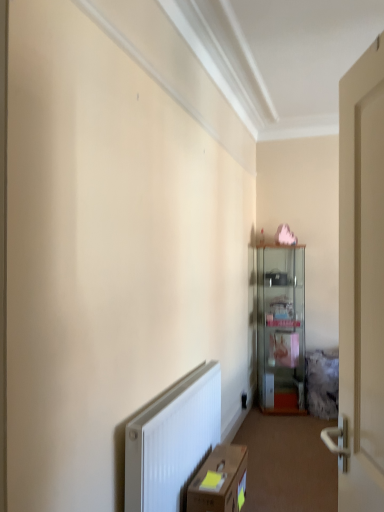
Image resolution: width=384 pixels, height=512 pixels. What do you see at coordinates (219, 481) in the screenshot?
I see `brown cardboard box at lower center` at bounding box center [219, 481].

Locate an element on the screen. This screenshot has height=512, width=384. brown cardboard box at lower center is located at coordinates (219, 481).

Describe the element at coordinates (281, 327) in the screenshot. This screenshot has width=384, height=512. I see `clear glass cabinet at center` at that location.

You are a GUI agent. You are given a task and a screenshot of the screen. Output one action in this format:
    pyautogui.click(x=<x>, y=<y>)
    Task: Click on the clear glass cabinet at center
    Image resolution: width=384 pixels, height=512 pixels.
    Given the screenshot: What is the action you would take?
    pyautogui.click(x=281, y=327)

The image size is (384, 512). I want to click on brown cardboard box at lower center, so click(x=219, y=481).

Is brown cardboard box at lower center at the left side of clear glass cabinet at center?

Yes.

Between brown cardboard box at lower center and clear glass cabinet at center, which one is positioned in front?

Positioned in front is brown cardboard box at lower center.

Is point (199, 500) in front of point (267, 288)?

Yes, point (199, 500) is in front of point (267, 288).

From the image's perspective, is brown cardboard box at lower center above or below clear glass cabinet at center?

Clearly, from the image's perspective, brown cardboard box at lower center is below clear glass cabinet at center.

From a real-world perspective, between brown cardboard box at lower center and clear glass cabinet at center, who is vertically higher?

clear glass cabinet at center.

Which of these two, brown cardboard box at lower center or clear glass cabinet at center, is wider?

clear glass cabinet at center is wider.

In terms of height, does brown cardboard box at lower center look taller or shorter compared to clear glass cabinet at center?

brown cardboard box at lower center is shorter than clear glass cabinet at center.

Which of these two, brown cardboard box at lower center or clear glass cabinet at center, is smaller?

Smaller between the two is brown cardboard box at lower center.

Is brown cardboard box at lower center not inside clear glass cabinet at center?

Absolutely, brown cardboard box at lower center is external to clear glass cabinet at center.

Are brown cardboard box at lower center and clear glass cabinet at center far apart?

Yes, brown cardboard box at lower center and clear glass cabinet at center are located far from each other.

Is clear glass cabinet at center at the back of brown cardboard box at lower center?

That's not correct — brown cardboard box at lower center is not looking away from clear glass cabinet at center.

Can you tell me how much brown cardboard box at lower center and clear glass cabinet at center differ in facing direction?

They differ by 74.7 degrees in their facing directions.

Find the location of `cabinetry behind the brown cardboard box at lower center`. cabinetry behind the brown cardboard box at lower center is located at coordinates (281, 327).

In the image, is clear glass cabinet at center on the left side or the right side of brown cardboard box at lower center?

In the image, clear glass cabinet at center appears on the right side of brown cardboard box at lower center.

Which object is closer to the camera taking this photo, clear glass cabinet at center or brown cardboard box at lower center?

Positioned in front is brown cardboard box at lower center.

Is point (299, 322) positioned before point (207, 469)?

No, (299, 322) is further to viewer.

From the image's perspective, is clear glass cabinet at center positioned above or below brown cardboard box at lower center?

Based on their image positions, clear glass cabinet at center is located above brown cardboard box at lower center.

From a real-world perspective, is clear glass cabinet at center located beneath brown cardboard box at lower center?

No, from a real-world perspective, clear glass cabinet at center is not beneath brown cardboard box at lower center.

In the scene shown: In terms of width, does clear glass cabinet at center look wider or thinner when compared to brown cardboard box at lower center?

In the image, clear glass cabinet at center appears to be wider than brown cardboard box at lower center.

Considering the relative sizes of clear glass cabinet at center and brown cardboard box at lower center in the image provided, is clear glass cabinet at center shorter than brown cardboard box at lower center?

Incorrect, the height of clear glass cabinet at center does not fall short of that of brown cardboard box at lower center.

Between clear glass cabinet at center and brown cardboard box at lower center, which one has larger size?

clear glass cabinet at center.

Can we say clear glass cabinet at center lies outside brown cardboard box at lower center?

Yes, clear glass cabinet at center is outside of brown cardboard box at lower center.

Is clear glass cabinet at center directly adjacent to brown cardboard box at lower center?

clear glass cabinet at center is not next to brown cardboard box at lower center, and they're not touching.

Is clear glass cabinet at center oriented towards brown cardboard box at lower center?

No, clear glass cabinet at center is not oriented towards brown cardboard box at lower center.

Can you tell me how much clear glass cabinet at center and brown cardboard box at lower center differ in facing direction?

74.7 degrees.

How far apart are clear glass cabinet at center and brown cardboard box at lower center?

A distance of 6.62 feet exists between clear glass cabinet at center and brown cardboard box at lower center.

Identify the location of cardboard box below the clear glass cabinet at center (from a real-world perspective). This screenshot has height=512, width=384. (219, 481).

Locate an element on the screen. cardboard box that is in front of the clear glass cabinet at center is located at coordinates (219, 481).

At what (x,y) coordinates should I click in order to perform the action: click on cardboard box located on the left of clear glass cabinet at center. Please return your answer as a coordinate pair (x, y). Looking at the image, I should click on (219, 481).